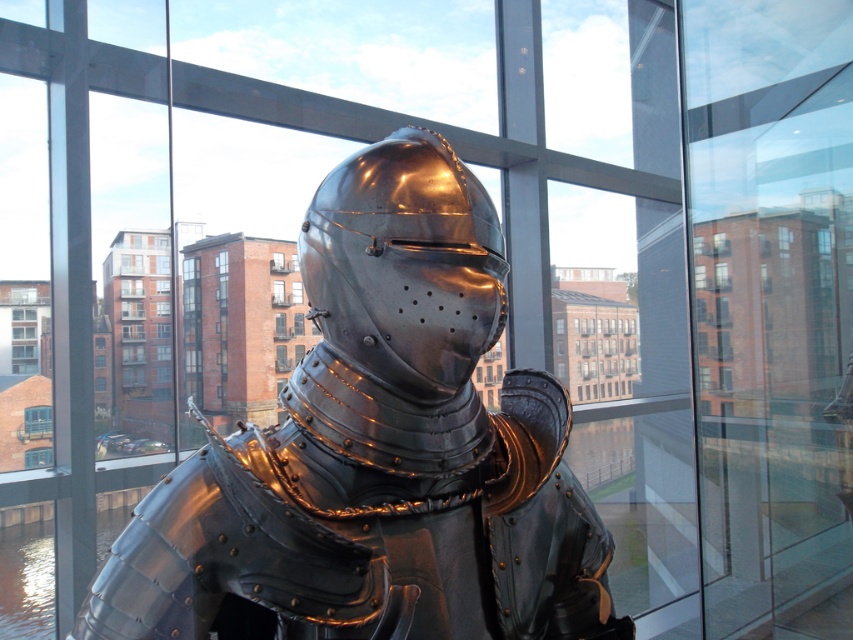
Question: Which is nearer to the shiny metallic helmet at center?

Choices:
 (A) shiny metal armor at center
 (B) clear glass window at center

Answer: (A)

Question: Which point is farther to the camera?

Choices:
 (A) shiny metal armor at center
 (B) brick wall at center
 (C) clear glass window at center
 (D) shiny metallic helmet at center

Answer: (B)

Question: Does clear glass window at center have a smaller size compared to brick wall at center?

Choices:
 (A) yes
 (B) no

Answer: (B)

Question: Considering the relative positions of shiny metallic helmet at center and clear glass window at center in the image provided, where is shiny metallic helmet at center located with respect to clear glass window at center?

Choices:
 (A) below
 (B) above

Answer: (B)

Question: Which object is the farthest from the brick wall at center?

Choices:
 (A) shiny metallic helmet at center
 (B) clear glass window at center

Answer: (A)

Question: Does shiny metal armor at center appear on the left side of clear glass window at center?

Choices:
 (A) yes
 (B) no

Answer: (B)